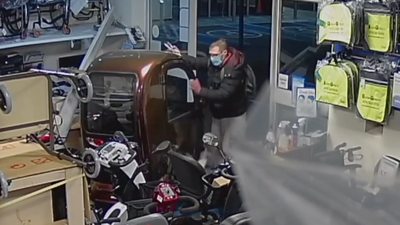
Identify the location of window. Image resolution: width=400 pixels, height=225 pixels. (169, 20), (291, 39), (282, 114), (115, 101), (174, 91).